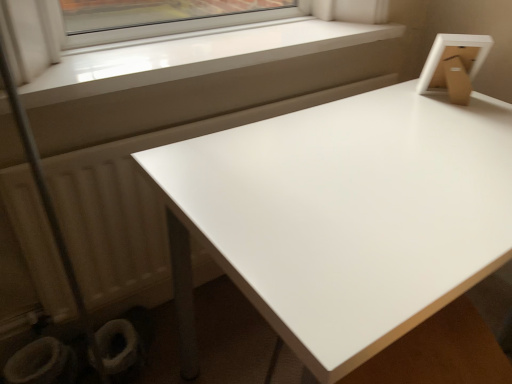
Question: Does white glossy toilet bowl at lower left, which appears as the 2th toilet bowl when viewed from the right, have a larger size compared to white smooth window sill at upper left?

Choices:
 (A) no
 (B) yes

Answer: (A)

Question: From the image's perspective, does white glossy toilet bowl at lower left, the 1th toilet bowl viewed from the left, appear lower than white smooth window sill at upper left?

Choices:
 (A) no
 (B) yes

Answer: (B)

Question: Is the position of white glossy toilet bowl at lower left, the 1th toilet bowl viewed from the left, more distant than that of white smooth window sill at upper left?

Choices:
 (A) no
 (B) yes

Answer: (B)

Question: Does white glossy toilet bowl at lower left, the 1th toilet bowl viewed from the left, lie in front of white smooth window sill at upper left?

Choices:
 (A) yes
 (B) no

Answer: (B)

Question: Is white glossy toilet bowl at lower left, the 1th toilet bowl viewed from the left, not close to white smooth window sill at upper left?

Choices:
 (A) no
 (B) yes

Answer: (A)

Question: In the image, is white matte radiator at lower left positioned in front of or behind white glossy table at upper right?

Choices:
 (A) front
 (B) behind

Answer: (B)

Question: Based on their sizes in the image, would you say white matte radiator at lower left is bigger or smaller than white glossy table at upper right?

Choices:
 (A) small
 (B) big

Answer: (A)

Question: Choose the correct answer: Is white matte radiator at lower left inside white glossy table at upper right or outside it?

Choices:
 (A) inside
 (B) outside

Answer: (B)

Question: Is white matte radiator at lower left taller or shorter than white glossy table at upper right?

Choices:
 (A) short
 (B) tall

Answer: (A)

Question: In the image, is white smooth window sill at upper left positioned in front of or behind white glossy table at upper right?

Choices:
 (A) front
 (B) behind

Answer: (B)

Question: Is white smooth window sill at upper left bigger or smaller than white glossy table at upper right?

Choices:
 (A) small
 (B) big

Answer: (A)

Question: Is point (355, 41) positioned closer to the camera than point (309, 299)?

Choices:
 (A) farther
 (B) closer

Answer: (A)

Question: In terms of height, does white smooth window sill at upper left look taller or shorter compared to white glossy table at upper right?

Choices:
 (A) tall
 (B) short

Answer: (B)

Question: Is white fabric toilet bowl at lower left, which appears as the 2th toilet bowl when viewed from the left, inside or outside of white glossy table at upper right?

Choices:
 (A) inside
 (B) outside

Answer: (B)

Question: Considering the positions of white fabric toilet bowl at lower left, which appears as the 2th toilet bowl when viewed from the left, and white glossy table at upper right in the image, is white fabric toilet bowl at lower left, which appears as the 2th toilet bowl when viewed from the left, wider or thinner than white glossy table at upper right?

Choices:
 (A) wide
 (B) thin

Answer: (B)